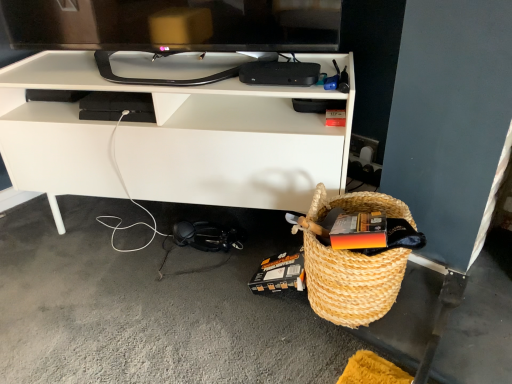
The image size is (512, 384). What are the coordinates of `vacant space in white matte desk at center (from a real-world perspective)` in the screenshot? It's located at (184, 225).